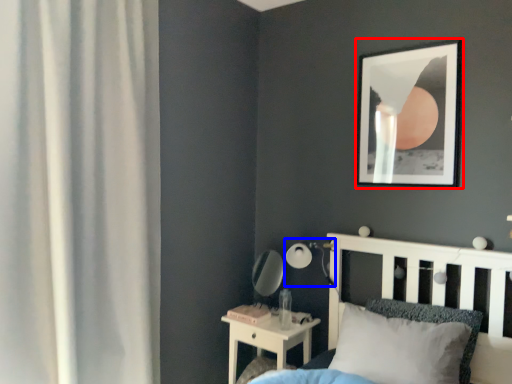
Question: Which of the following is the farthest to the observer, picture frame (highlighted by a red box) or table lamp (highlighted by a blue box)?

Choices:
 (A) picture frame
 (B) table lamp

Answer: (B)